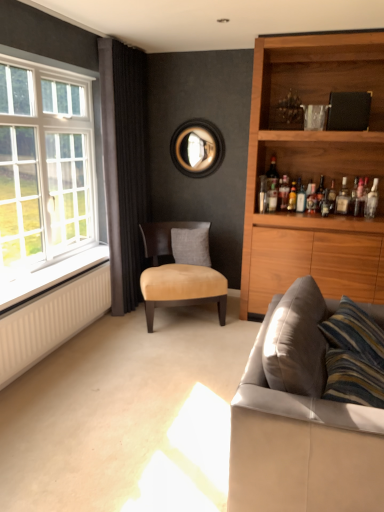
Question: Considering the relative sizes of translucent glass bottle at upper right, the 5th bottle positioned from the right, and clear glass bottle at upper right, which is counted as the first bottle, starting from the left, in the image provided, is translucent glass bottle at upper right, the 5th bottle positioned from the right, wider than clear glass bottle at upper right, which is counted as the first bottle, starting from the left,?

Choices:
 (A) no
 (B) yes

Answer: (B)

Question: Can you confirm if translucent glass bottle at upper right, marked as the 2th bottle in a left-to-right arrangement, is bigger than clear glass bottle at upper right, which is the sixth bottle in right-to-left order?

Choices:
 (A) no
 (B) yes

Answer: (B)

Question: Is translucent glass bottle at upper right, marked as the 2th bottle in a left-to-right arrangement, completely or partially outside of clear glass bottle at upper right, which is the sixth bottle in right-to-left order?

Choices:
 (A) yes
 (B) no

Answer: (A)

Question: Is translucent glass bottle at upper right, marked as the 2th bottle in a left-to-right arrangement, closer to the viewer compared to clear glass bottle at upper right, which is counted as the first bottle, starting from the left?

Choices:
 (A) no
 (B) yes

Answer: (A)

Question: Is translucent glass bottle at upper right, marked as the 2th bottle in a left-to-right arrangement, turned away from clear glass bottle at upper right, which is counted as the first bottle, starting from the left?

Choices:
 (A) no
 (B) yes

Answer: (A)

Question: Is white glass window at left inside or outside of leather couch at lower right?

Choices:
 (A) inside
 (B) outside

Answer: (B)

Question: From a real-world perspective, relative to leather couch at lower right, is white glass window at left vertically above or below?

Choices:
 (A) below
 (B) above

Answer: (B)

Question: Based on their sizes in the image, would you say white glass window at left is bigger or smaller than leather couch at lower right?

Choices:
 (A) big
 (B) small

Answer: (B)

Question: Visually, is white glass window at left positioned to the left or to the right of leather couch at lower right?

Choices:
 (A) left
 (B) right

Answer: (A)

Question: Is gray fabric pillow at center inside the boundaries of matte glass bottle at upper right, which ranks as the third bottle in left-to-right order, or outside?

Choices:
 (A) inside
 (B) outside

Answer: (B)

Question: Looking at the image, does gray fabric pillow at center seem bigger or smaller compared to matte glass bottle at upper right, the fourth bottle from the right?

Choices:
 (A) big
 (B) small

Answer: (A)

Question: Looking at their shapes, would you say gray fabric pillow at center is wider or thinner than matte glass bottle at upper right, the fourth bottle from the right?

Choices:
 (A) wide
 (B) thin

Answer: (A)

Question: Is point (185, 232) closer or farther from the camera than point (304, 196)?

Choices:
 (A) farther
 (B) closer

Answer: (A)

Question: Is white radiator at lower left to the left or to the right of clear glass bottle at upper right, which is the sixth bottle in right-to-left order, in the image?

Choices:
 (A) left
 (B) right

Answer: (A)

Question: Considering their positions, is white radiator at lower left located in front of or behind clear glass bottle at upper right, which is counted as the first bottle, starting from the left?

Choices:
 (A) front
 (B) behind

Answer: (A)